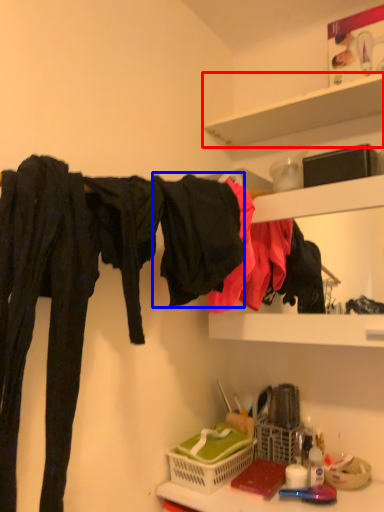
Question: Which point is further to the camera, shelf (highlighted by a red box) or clothing (highlighted by a blue box)?

Choices:
 (A) shelf
 (B) clothing

Answer: (A)